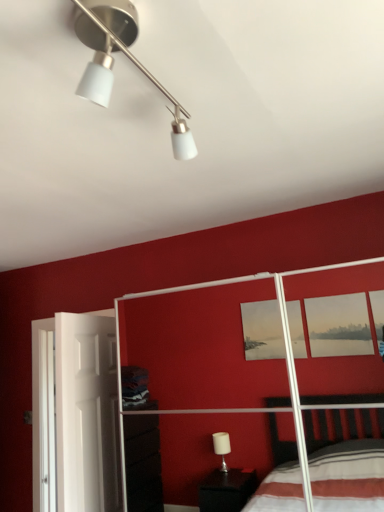
Question: In terms of size, does matte white bed frame at center appear bigger or smaller than white matte track light at upper center?

Choices:
 (A) big
 (B) small

Answer: (A)

Question: Considering the positions of point (354, 220) and point (102, 7), is point (354, 220) closer or farther from the camera than point (102, 7)?

Choices:
 (A) farther
 (B) closer

Answer: (A)

Question: Estimate the real-world distances between objects in this image. Which object is closer to the white matte track light at upper center?

Choices:
 (A) white matte screen door at left
 (B) matte white bed frame at center

Answer: (A)

Question: Which is farther from the matte white bed frame at center?

Choices:
 (A) white matte screen door at left
 (B) white matte track light at upper center

Answer: (B)